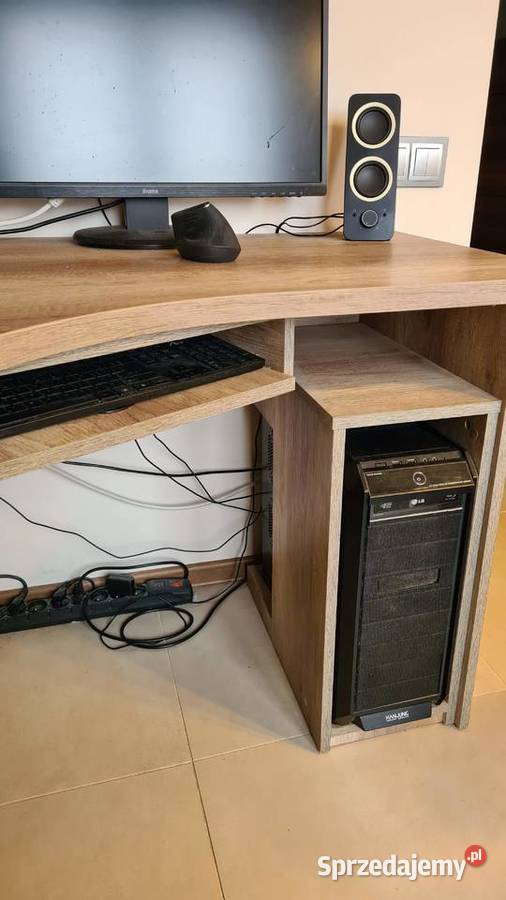
What are the coordinates of `monitor` in the screenshot? It's located at (225, 153).